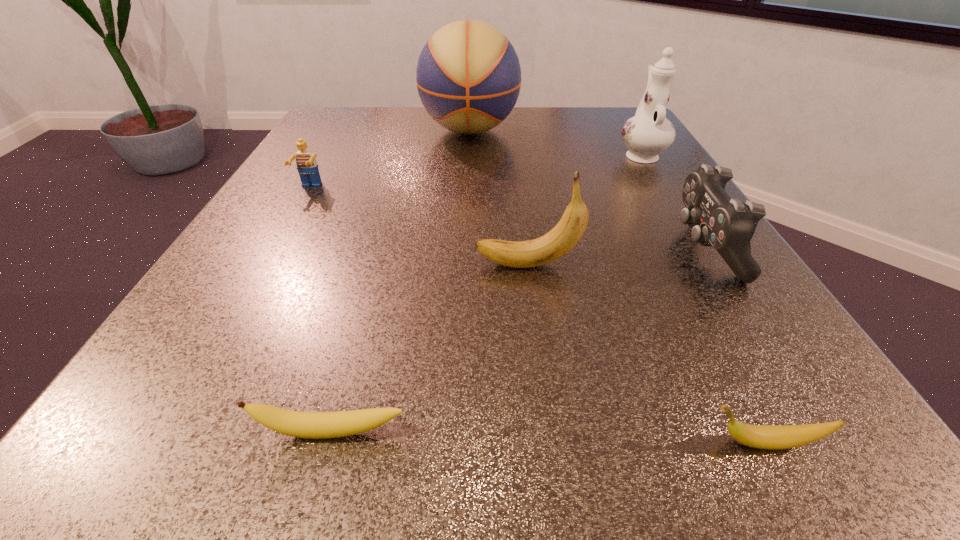
The height and width of the screenshot is (540, 960). I want to click on free space located at the spout of the chinaware, so click(x=613, y=109).

I want to click on free space located 0.130m at the spout of the chinaware, so click(x=618, y=118).

Identify the location of free space located 0.080m at the spout of the chinaware. (624, 126).

Locate an element on the screen. vacant region located 0.310m at the start of the peel on the tallest banana is located at coordinates (265, 265).

Image resolution: width=960 pixels, height=540 pixels. What are the coordinates of `free space located at the start of the peel on the tallest banana` in the screenshot? It's located at (400, 265).

Locate an element on the screen. The height and width of the screenshot is (540, 960). free space located 0.080m at the start of the peel on the tallest banana is located at coordinates (420, 265).

Find the location of a particular element. The image size is (960, 540). free point located on the surface of the control with buttons is located at coordinates (427, 248).

At what (x,y) coordinates should I click in order to perform the action: click on free point located 0.250m on the surface of the control with buttons. Please return your answer as a coordinate pair (x, y). Image resolution: width=960 pixels, height=540 pixels. Looking at the image, I should click on (517, 248).

You are a GUI agent. You are given a task and a screenshot of the screen. Output one action in this format:
    pyautogui.click(x=<x>, y=<y>)
    Task: Click on the vacant space located on the surface of the control with buttons
    This screenshot has height=540, width=960.
    Given the screenshot: What is the action you would take?
    pyautogui.click(x=556, y=248)

Find the location of `free space located 0.140m on the face of the leftmost object`. free space located 0.140m on the face of the leftmost object is located at coordinates (280, 240).